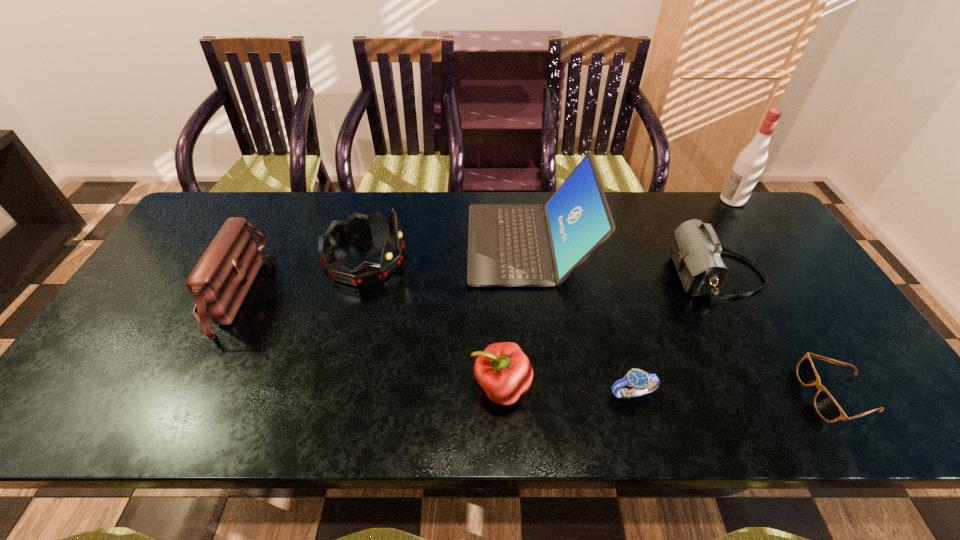
Find the location of a particular element. The width and height of the screenshot is (960, 540). free region located on the frames of the shortest object is located at coordinates (727, 395).

Locate an element on the screen. vacant region located on the frames of the shortest object is located at coordinates (628, 395).

Find the location of a particular element. Image resolution: width=960 pixels, height=540 pixels. vacant area situated on the frames of the shortest object is located at coordinates (745, 395).

The height and width of the screenshot is (540, 960). Find the location of `alcohol that is at the far edge`. alcohol that is at the far edge is located at coordinates (750, 163).

Locate an element on the screen. laptop computer located at the far edge is located at coordinates (513, 245).

You are a GUI agent. You are given a task and a screenshot of the screen. Output one action in this format:
    pyautogui.click(x=<x>, y=<y>)
    Task: Click on the tiara that is at the far edge
    
    Given the screenshot: What is the action you would take?
    pyautogui.click(x=356, y=225)

Locate an element on the screen. This screenshot has height=540, width=960. bell pepper present at the near edge is located at coordinates (505, 373).

Identify the location of watch at the near edge. (641, 382).

Locate an element on the screen. This screenshot has width=960, height=540. sunglasses that is positioned at the near edge is located at coordinates (826, 406).

You are a GUI agent. You are given a task and a screenshot of the screen. Output one action in this format:
    pyautogui.click(x=<x>, y=<y>)
    Task: Click on the alcohol situated at the right edge
    
    Given the screenshot: What is the action you would take?
    pyautogui.click(x=750, y=163)